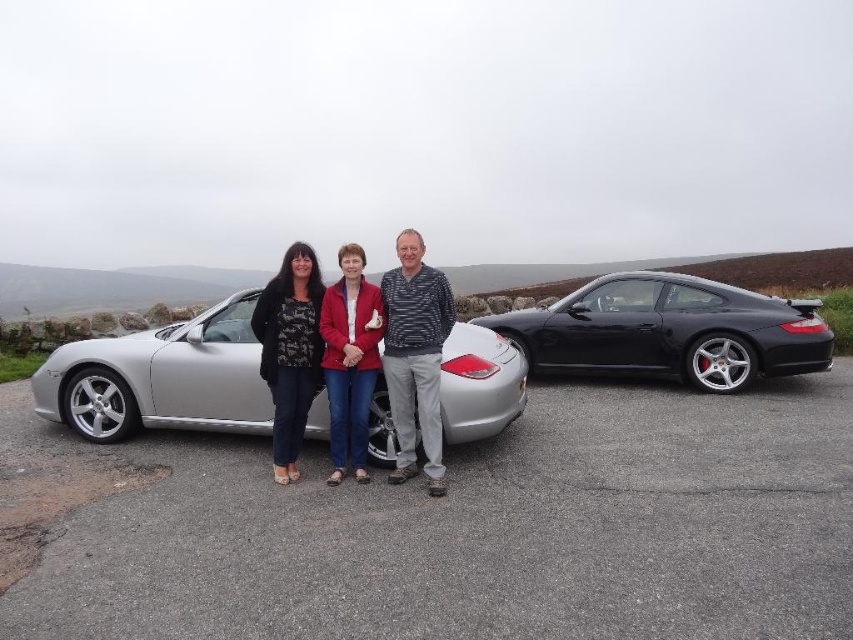
You are a photographer trying to capture a group photo of the three people and the two cars. You need to ensure that the matte black car at center and the matte red jacket at center are clearly visible in the frame. Given that your camera has a minimum focus distance of 5 inches, will you be able to capture both objects without moving the subjects?

The matte black car at center is only 4.95 inches from the matte red jacket at center, which is less than the camera minimum focus distance of 5 inches. Therefore, you cannot capture both objects clearly without moving the subjects.